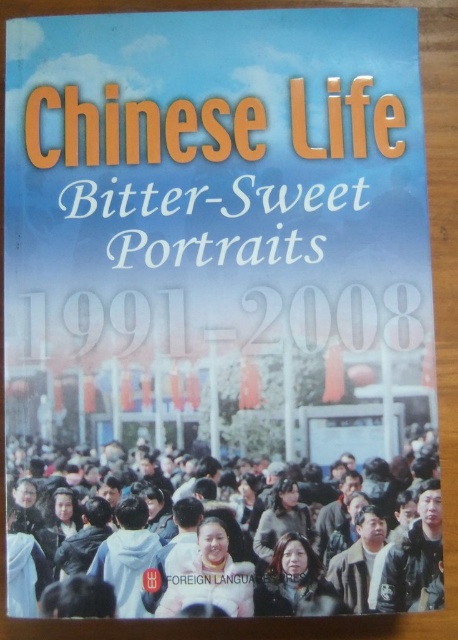
You are holding the matte paper book at center and want to place it on a shelf next to the dark brown hair at center. The shelf has a width of 12 inches. Can the book and the hair fit side by side on the shelf?

The matte paper book at center and dark brown hair at center are 7.07 inches apart, so together they require 7.07 inches of space. Since the shelf is 12 inches wide, they can fit side by side with 4.93 inches of extra space remaining.

You are designing a display for a library and want to place the matte paper book at center and the dark brown hair at center next to each other. Based on their sizes, which one should you place first to ensure they fit properly?

The matte paper book at center is larger than the dark brown hair at center, so you should place the matte paper book at center first to accommodate its size.